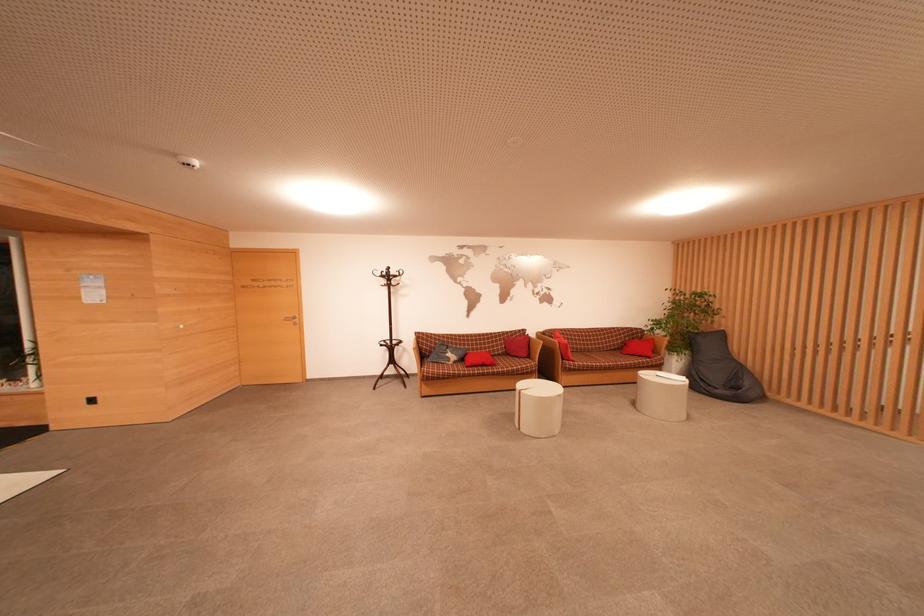
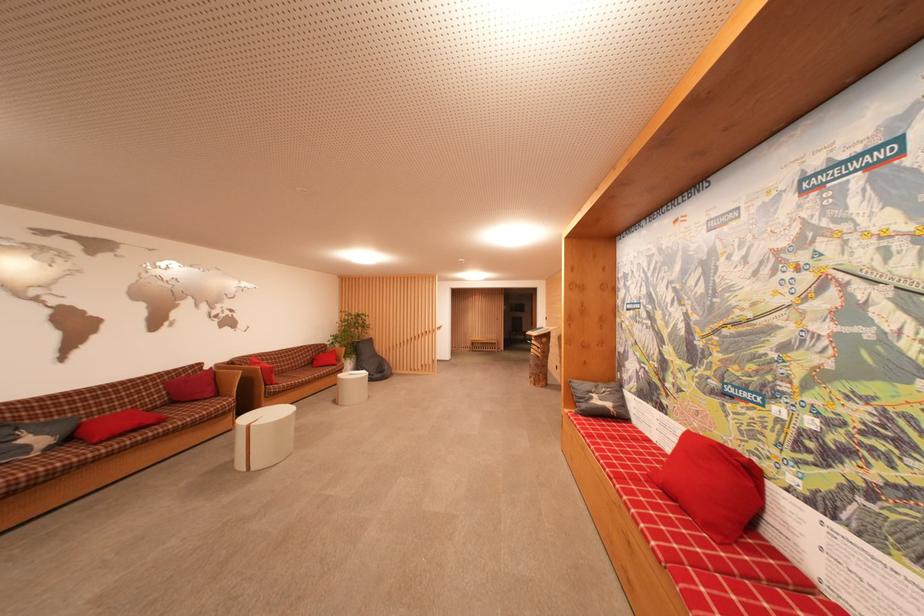
Locate, in the second image, the point that corresponds to (516,339) in the first image.

(183, 378)